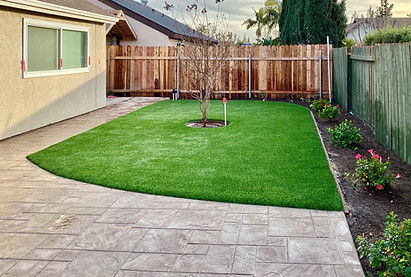
You are a GUI agent. You are given a task and a screenshot of the screen. Output one action in this format:
    pyautogui.click(x=<x>, y=<y>)
    Task: Click on the window
    
    Given the screenshot: What is the action you would take?
    pyautogui.click(x=45, y=57), pyautogui.click(x=74, y=53)